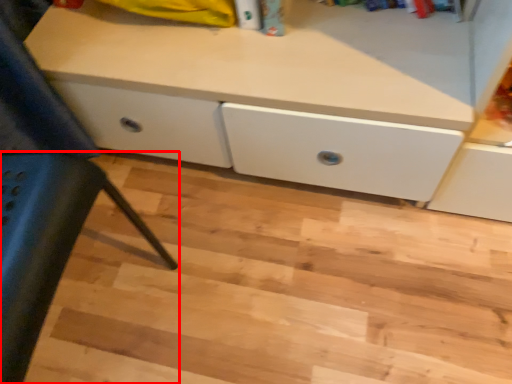
Question: From the image's perspective, where is furniture (annotated by the red box) located in relation to stair in the image?

Choices:
 (A) above
 (B) below

Answer: (A)